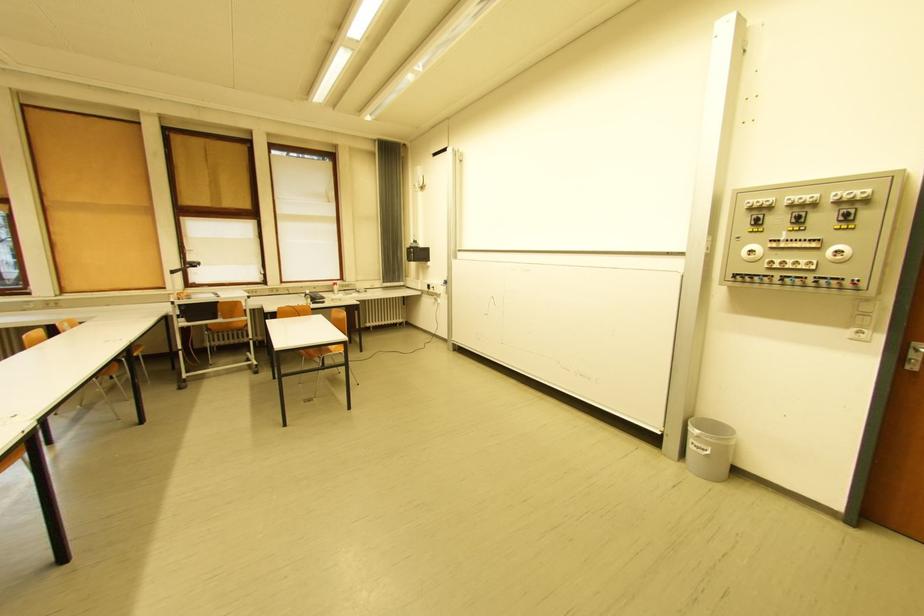
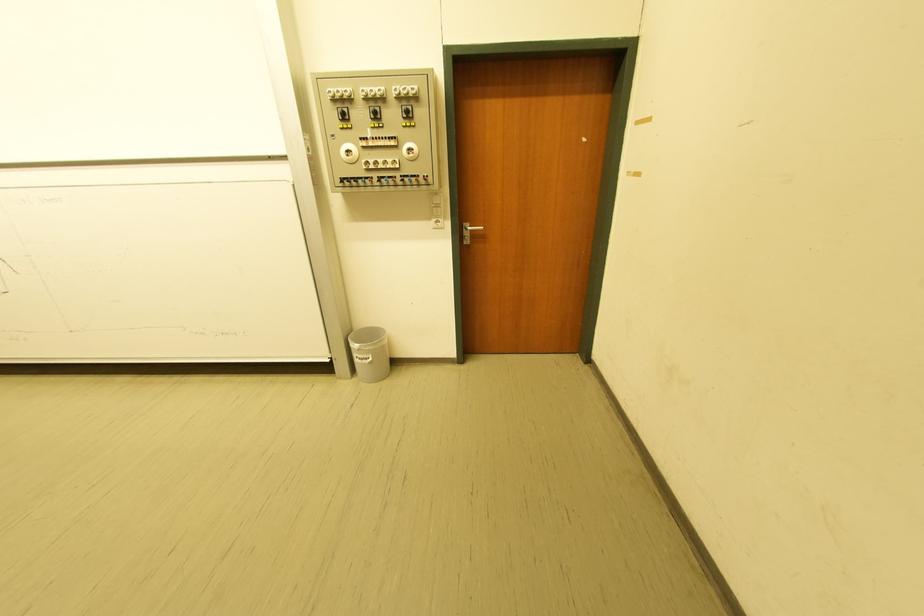
In the second image, find the point that corresponds to (807,268) in the first image.

(395, 168)